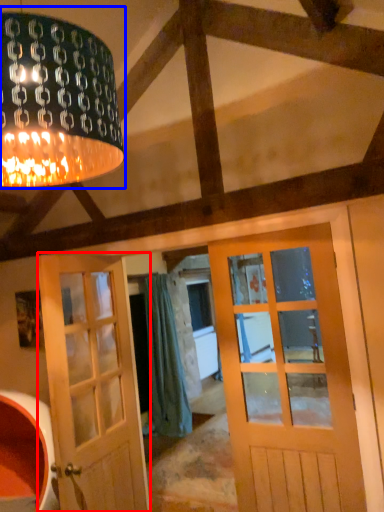
Question: Which object appears closest to the camera in this image, door (highlighted by a red box) or lamp (highlighted by a blue box)?

Choices:
 (A) door
 (B) lamp

Answer: (B)